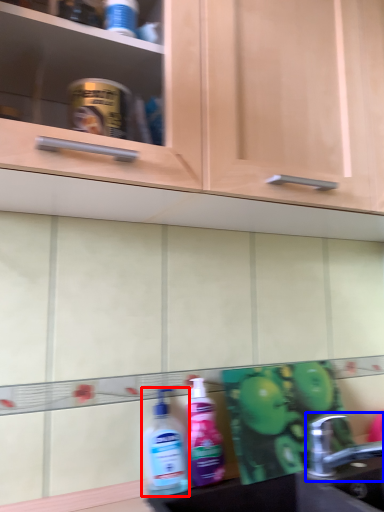
Question: Which of the following is the farthest to the observer, cleaning product (highlighted by a red box) or tap (highlighted by a blue box)?

Choices:
 (A) cleaning product
 (B) tap

Answer: (A)